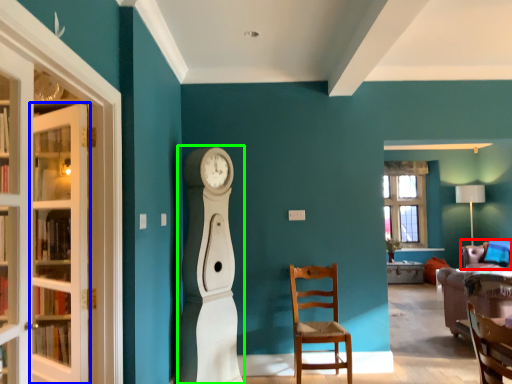
Question: Which object is positioned closest to chair (highlighted by a red box)? Select from door (highlighted by a blue box) and open (highlighted by a green box).

Choices:
 (A) door
 (B) open

Answer: (B)